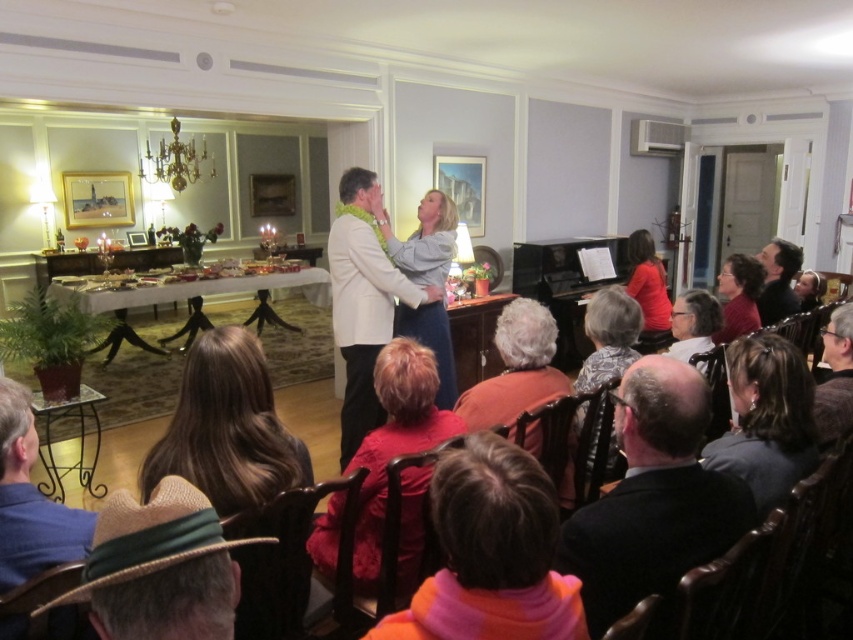
Question: Among these points, which one is nearest to the camera?

Choices:
 (A) (425, 196)
 (B) (544, 328)
 (C) (764, 304)

Answer: (B)

Question: Does red sweater at center appear on the right side of dark brown hair at center?

Choices:
 (A) yes
 (B) no

Answer: (B)

Question: Where is straw hat at lower left located in relation to matte red sweater at center in the image?

Choices:
 (A) left
 (B) right

Answer: (A)

Question: Among these points, which one is nearest to the camera?

Choices:
 (A) (781, 294)
 (B) (712, 460)

Answer: (B)

Question: In this image, where is straw hat at lower left located relative to denim jacket at center?

Choices:
 (A) right
 (B) left

Answer: (B)

Question: Considering the real-world distances, which object is closest to the orange fleece sweater at lower center?

Choices:
 (A) orange fabric chair at center
 (B) white matte suit at center
 (C) gray hair at center

Answer: (A)